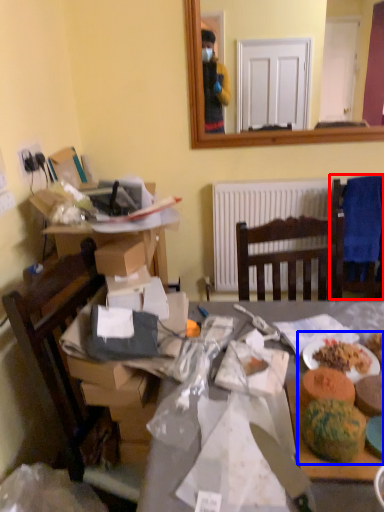
Question: Which object is closer to the camera taking this photo, chair (highlighted by a red box) or food (highlighted by a blue box)?

Choices:
 (A) chair
 (B) food

Answer: (B)